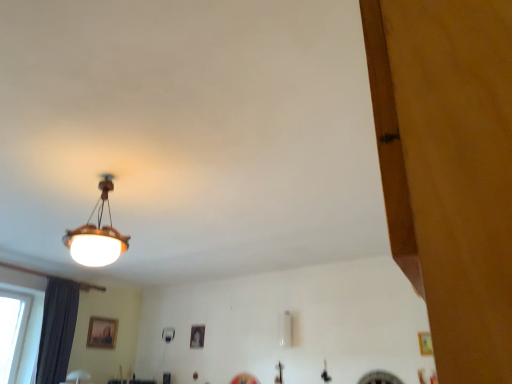
Question: Does wooden picture frame at lower center, which is the first picture frame in left-to-right order, have a smaller size compared to matte black picture frame at center, which appears as the 1th picture frame when viewed from the right?

Choices:
 (A) no
 (B) yes

Answer: (A)

Question: Are wooden picture frame at lower center, which is the second picture frame in right-to-left order, and matte black picture frame at center, the 2th picture frame in the left-to-right sequence, located far from each other?

Choices:
 (A) no
 (B) yes

Answer: (B)

Question: Is wooden picture frame at lower center, which is the first picture frame in left-to-right order, touching matte black picture frame at center, the 2th picture frame in the left-to-right sequence?

Choices:
 (A) yes
 (B) no

Answer: (B)

Question: Considering the relative positions of wooden picture frame at lower center, which is the first picture frame in left-to-right order, and matte black picture frame at center, the 2th picture frame in the left-to-right sequence, in the image provided, is wooden picture frame at lower center, which is the first picture frame in left-to-right order, to the left of matte black picture frame at center, the 2th picture frame in the left-to-right sequence, from the viewer's perspective?

Choices:
 (A) yes
 (B) no

Answer: (A)

Question: Is wooden picture frame at lower center, which is the second picture frame in right-to-left order, completely or partially outside of matte black picture frame at center, the 2th picture frame in the left-to-right sequence?

Choices:
 (A) no
 (B) yes

Answer: (B)

Question: Looking at their shapes, would you say matte wooden lampshade at upper left is wider or thinner than wooden picture frame at lower center, which is the second picture frame in right-to-left order?

Choices:
 (A) wide
 (B) thin

Answer: (A)

Question: Relative to wooden picture frame at lower center, which is the second picture frame in right-to-left order, is matte wooden lampshade at upper left in front or behind?

Choices:
 (A) behind
 (B) front

Answer: (B)

Question: Based on their sizes in the image, would you say matte wooden lampshade at upper left is bigger or smaller than wooden picture frame at lower center, which is the second picture frame in right-to-left order?

Choices:
 (A) small
 (B) big

Answer: (B)

Question: Is matte wooden lampshade at upper left inside the boundaries of wooden picture frame at lower center, which is the first picture frame in left-to-right order, or outside?

Choices:
 (A) outside
 (B) inside

Answer: (A)

Question: Is dark gray fabric curtain at left wider or thinner than wooden picture frame at lower center, which is the second picture frame in right-to-left order?

Choices:
 (A) wide
 (B) thin

Answer: (A)

Question: Considering the positions of dark gray fabric curtain at left and wooden picture frame at lower center, which is the second picture frame in right-to-left order, in the image, is dark gray fabric curtain at left bigger or smaller than wooden picture frame at lower center, which is the second picture frame in right-to-left order,?

Choices:
 (A) big
 (B) small

Answer: (A)

Question: Is dark gray fabric curtain at left in front of or behind wooden picture frame at lower center, which is the second picture frame in right-to-left order, in the image?

Choices:
 (A) behind
 (B) front

Answer: (B)

Question: Does point (51, 337) appear closer or farther from the camera than point (109, 342)?

Choices:
 (A) closer
 (B) farther

Answer: (A)

Question: Considering the positions of dark gray fabric curtain at left and matte black picture frame at center, which appears as the 1th picture frame when viewed from the right, in the image, is dark gray fabric curtain at left wider or thinner than matte black picture frame at center, which appears as the 1th picture frame when viewed from the right,?

Choices:
 (A) wide
 (B) thin

Answer: (A)

Question: From a real-world perspective, is dark gray fabric curtain at left physically located above or below matte black picture frame at center, the 2th picture frame in the left-to-right sequence?

Choices:
 (A) below
 (B) above

Answer: (A)